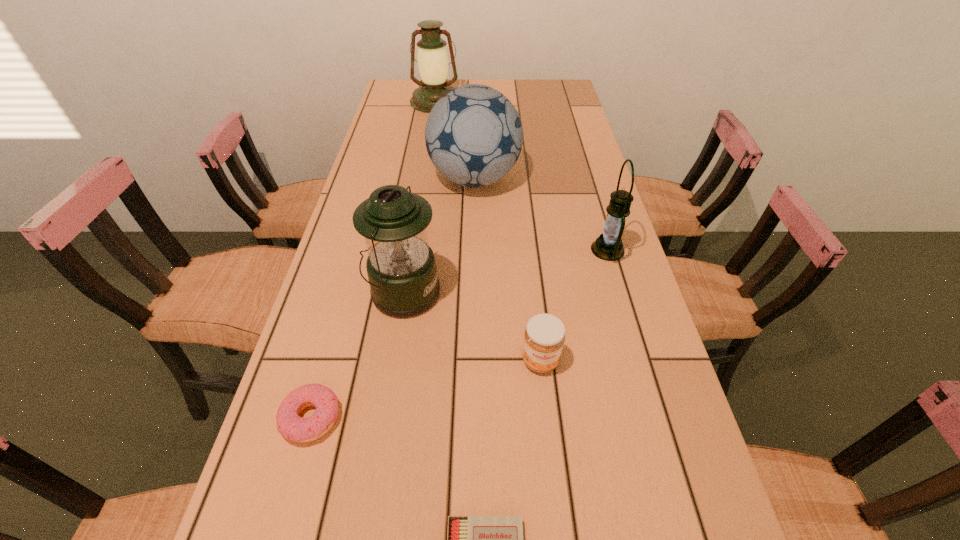
Locate an element on the screen. Image resolution: width=960 pixels, height=540 pixels. free space located 0.180m on the side with brand of the soccer ball is located at coordinates (580, 179).

Find the location of `vacant region located on the back of the nearest lantern`. vacant region located on the back of the nearest lantern is located at coordinates (420, 185).

Identify the location of free space located on the side where the rightmost lantern emits light. point(492,249).

Locate an element on the screen. The width and height of the screenshot is (960, 540). free space located 0.270m on the side where the rightmost lantern emits light is located at coordinates (485, 249).

The height and width of the screenshot is (540, 960). I want to click on vacant space located on the side where the rightmost lantern emits light, so click(532, 249).

Find the location of `vacant space located on the front label of the fifth farthest object`. vacant space located on the front label of the fifth farthest object is located at coordinates (557, 510).

What are the coordinates of `vacant area situated on the back of the second nearest object` in the screenshot? It's located at (359, 250).

At what (x,y) coordinates should I click in order to perform the action: click on object located in the far edge section of the desktop. Please return your answer as a coordinate pair (x, y). The height and width of the screenshot is (540, 960). Looking at the image, I should click on (432, 58).

The image size is (960, 540). I want to click on doughnut that is at the left edge, so click(292, 427).

Locate an element on the screen. object present at the right edge is located at coordinates (608, 246).